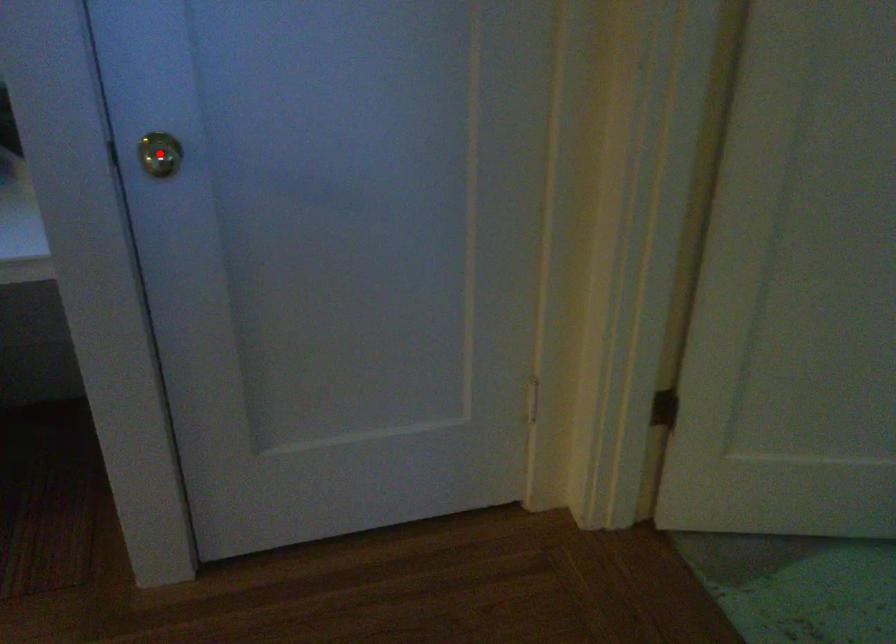
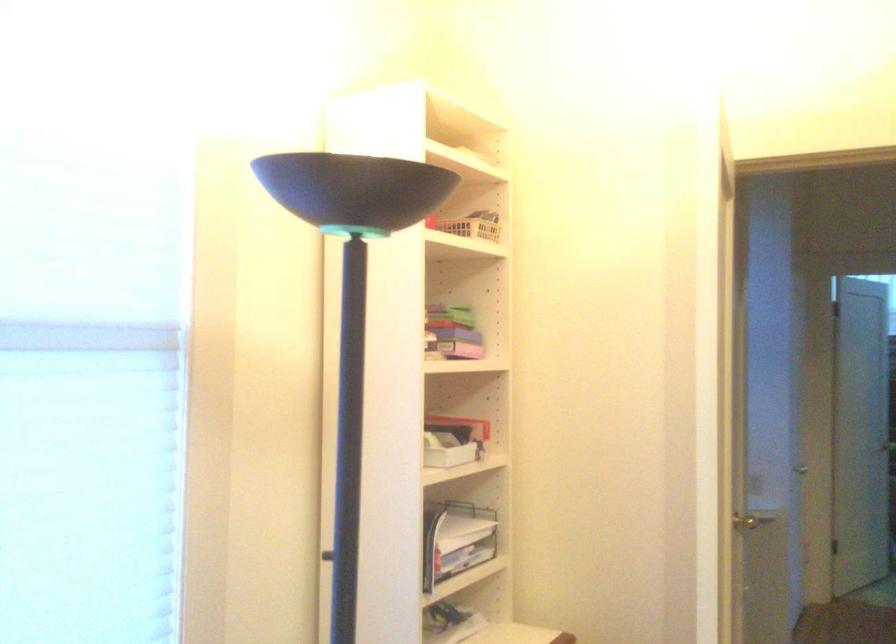
Question: I am providing you with two images of the same scene from different viewpoints. A red point is marked on the first image. At the location where the point appears in image 1, is it still visible in image 2?

Choices:
 (A) Yes
 (B) No

Answer: (B)